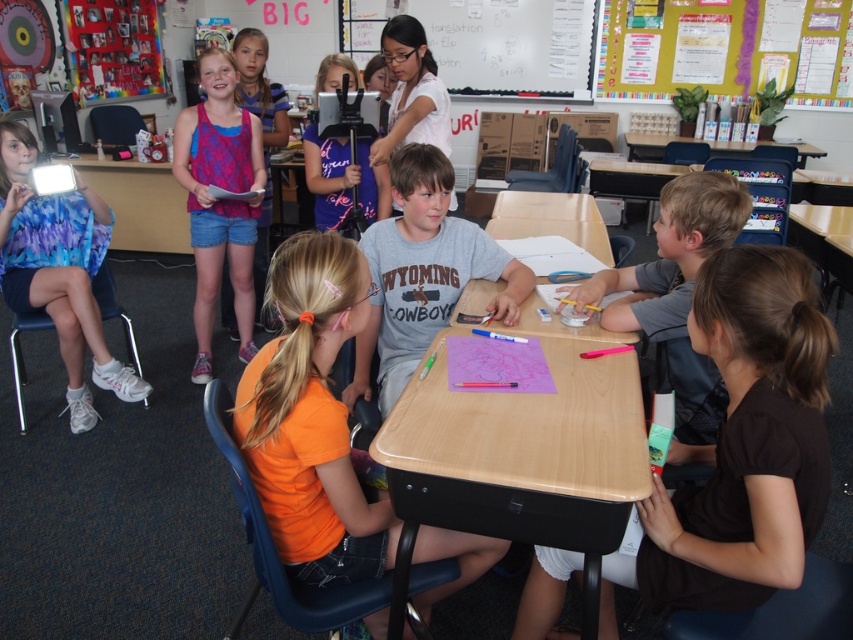
Question: Is blue tie-dye shirt at left wider than whiteboard at upper center?

Choices:
 (A) no
 (B) yes

Answer: (A)

Question: Can you confirm if orange t-shirt at center is bigger than wooden table at upper right?

Choices:
 (A) no
 (B) yes

Answer: (A)

Question: Which point is farther to the camera?

Choices:
 (A) tap(531, 19)
 (B) tap(730, 227)
 (C) tap(376, 497)
 (D) tap(717, 150)

Answer: (A)

Question: Which object is closer to the camera taking this photo?

Choices:
 (A) light brown wood desk at center
 (B) brown matte shirt at lower right

Answer: (B)

Question: Which point is farther from the camera taking this photo?

Choices:
 (A) (660, 557)
 (B) (350, 67)
 (C) (335, 508)
 (D) (403, 355)

Answer: (B)

Question: Is gray matte shirt at right further to camera compared to whiteboard at upper center?

Choices:
 (A) no
 (B) yes

Answer: (A)